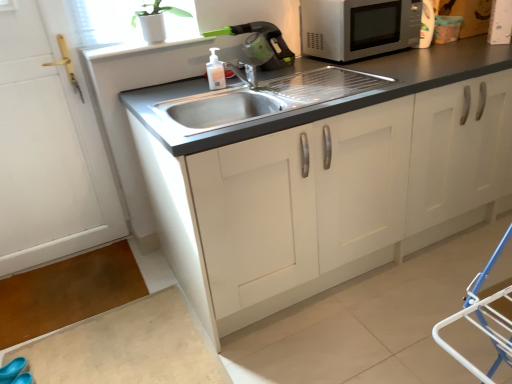
This screenshot has width=512, height=384. What are the coordinates of `free space to the right of blue rubber shoe at lower left` in the screenshot? It's located at (69, 370).